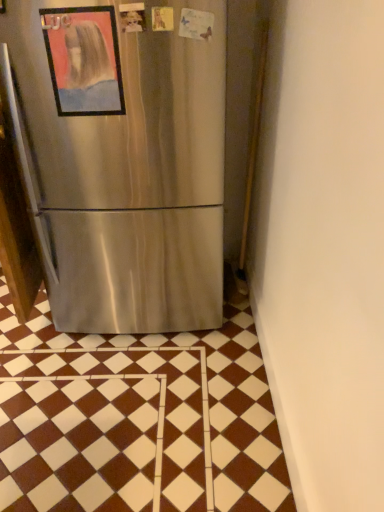
Question: In terms of size, does brown glossy tile at center appear bigger or smaller than metallic framed painting at upper left?

Choices:
 (A) big
 (B) small

Answer: (A)

Question: Is brown glossy tile at center wider or thinner than metallic framed painting at upper left?

Choices:
 (A) wide
 (B) thin

Answer: (A)

Question: Visually, is brown glossy tile at center positioned to the left or to the right of metallic framed painting at upper left?

Choices:
 (A) right
 (B) left

Answer: (B)

Question: Is metallic framed painting at upper left taller or shorter than brown glossy tile at center?

Choices:
 (A) tall
 (B) short

Answer: (A)

Question: Visually, is metallic framed painting at upper left positioned to the left or to the right of brown glossy tile at center?

Choices:
 (A) left
 (B) right

Answer: (B)

Question: Considering the positions of metallic framed painting at upper left and brown glossy tile at center in the image, is metallic framed painting at upper left bigger or smaller than brown glossy tile at center?

Choices:
 (A) big
 (B) small

Answer: (B)

Question: Is metallic framed painting at upper left spatially inside brown glossy tile at center, or outside of it?

Choices:
 (A) inside
 (B) outside

Answer: (B)